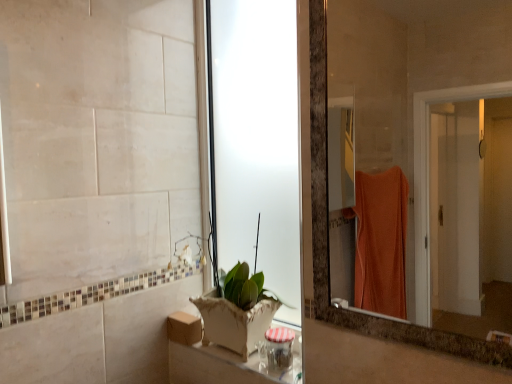
Question: From the image's perspective, is wooden box at lower center located above white ceramic pot at lower center?

Choices:
 (A) no
 (B) yes

Answer: (A)

Question: Is wooden box at lower center not inside white ceramic pot at lower center?

Choices:
 (A) yes
 (B) no

Answer: (A)

Question: Is wooden box at lower center shorter than white ceramic pot at lower center?

Choices:
 (A) no
 (B) yes

Answer: (B)

Question: Is wooden box at lower center closer to camera compared to white ceramic pot at lower center?

Choices:
 (A) yes
 (B) no

Answer: (B)

Question: Can you confirm if wooden box at lower center is wider than white ceramic pot at lower center?

Choices:
 (A) yes
 (B) no

Answer: (B)

Question: From a real-world perspective, is transparent frosted glass door at center positioned above or below white ceramic pot at lower center?

Choices:
 (A) below
 (B) above

Answer: (B)

Question: Considering the positions of transparent frosted glass door at center and white ceramic pot at lower center in the image, is transparent frosted glass door at center wider or thinner than white ceramic pot at lower center?

Choices:
 (A) wide
 (B) thin

Answer: (B)

Question: Looking at the image, does transparent frosted glass door at center seem bigger or smaller compared to white ceramic pot at lower center?

Choices:
 (A) big
 (B) small

Answer: (B)

Question: Is transparent frosted glass door at center spatially inside white ceramic pot at lower center, or outside of it?

Choices:
 (A) outside
 (B) inside

Answer: (A)

Question: From a real-world perspective, is white ceramic pot at lower center physically located above or below wooden box at lower center?

Choices:
 (A) below
 (B) above

Answer: (B)

Question: Considering the positions of white ceramic pot at lower center and wooden box at lower center in the image, is white ceramic pot at lower center bigger or smaller than wooden box at lower center?

Choices:
 (A) small
 (B) big

Answer: (B)

Question: Considering the relative positions of white ceramic pot at lower center and wooden box at lower center in the image provided, is white ceramic pot at lower center to the left or to the right of wooden box at lower center?

Choices:
 (A) left
 (B) right

Answer: (B)

Question: Is white ceramic pot at lower center taller or shorter than wooden box at lower center?

Choices:
 (A) short
 (B) tall

Answer: (B)

Question: In the image, is white ceramic pot at lower center positioned in front of or behind transparent frosted glass door at center?

Choices:
 (A) front
 (B) behind

Answer: (A)

Question: Considering the positions of white ceramic pot at lower center and transparent frosted glass door at center in the image, is white ceramic pot at lower center taller or shorter than transparent frosted glass door at center?

Choices:
 (A) tall
 (B) short

Answer: (B)